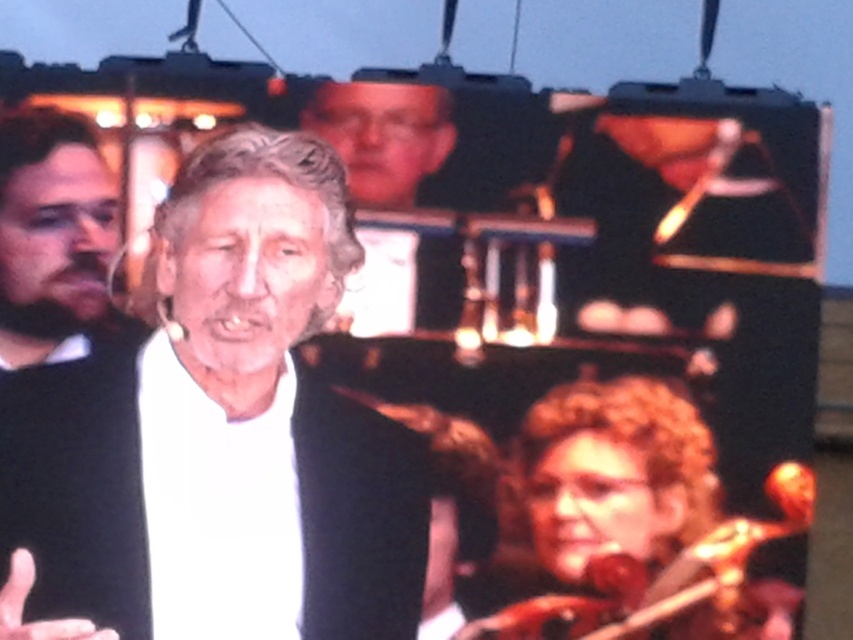
Question: Which object is closer to the camera taking this photo?

Choices:
 (A) bearded man at left
 (B) curly blonde hair at lower right
 (C) black matte sweater at left
 (D) white matte hand at lower left

Answer: (D)

Question: Estimate the real-world distances between objects in this image. Which object is farther from the bearded man at left?

Choices:
 (A) matte black glasses at upper center
 (B) curly blonde hair at lower right
 (C) black matte sweater at left
 (D) white matte hand at lower left

Answer: (D)

Question: Does curly blonde hair at lower right appear under matte black glasses at upper center?

Choices:
 (A) yes
 (B) no

Answer: (A)

Question: Is white matte shirt at center wider than matte black glasses at upper center?

Choices:
 (A) no
 (B) yes

Answer: (B)

Question: Considering the relative positions of curly blonde hair at lower right and black matte sweater at left in the image provided, where is curly blonde hair at lower right located with respect to black matte sweater at left?

Choices:
 (A) below
 (B) above

Answer: (A)

Question: Which point is farther to the camera?

Choices:
 (A) matte black glasses at upper center
 (B) white matte hand at lower left
 (C) bearded man at left
 (D) white matte shirt at center

Answer: (A)